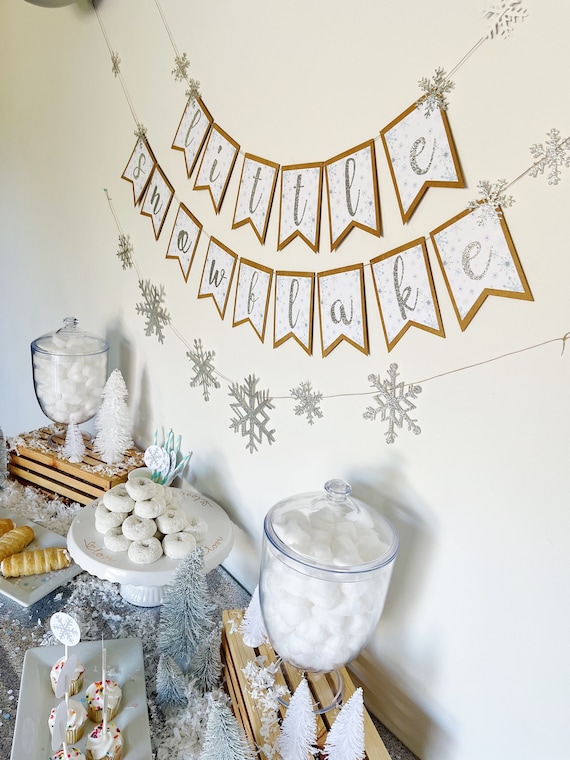
Identify the location of wooden boxes. (236, 651), (78, 472).